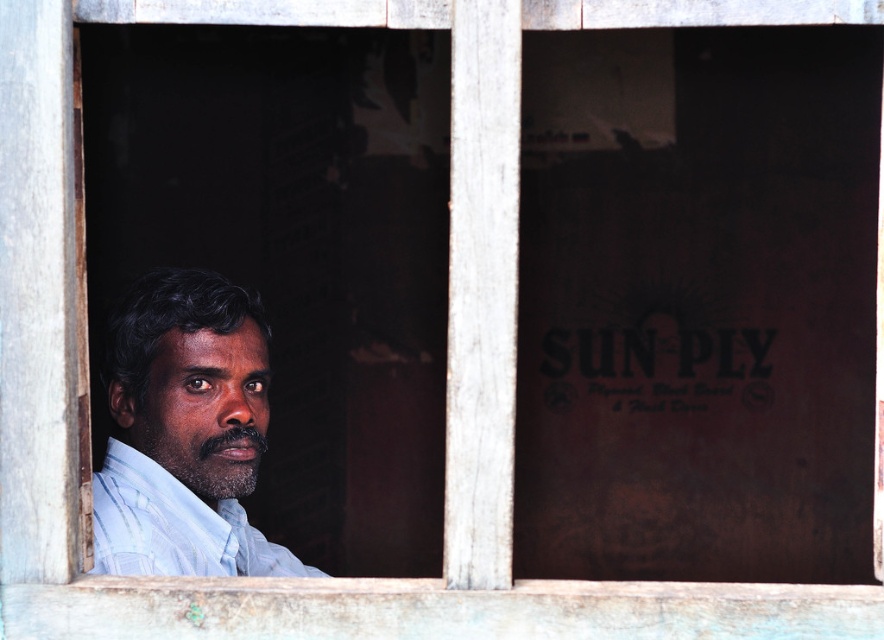
You are a photographer trying to capture both the light blue shirt at center and the light blue cotton shirt at left in a single shot. Which shirt should you focus on first to ensure both are in focus?

You should focus on the light blue cotton shirt at left first because it is farther away than the light blue shirt at center, ensuring both will be in focus.

Looking at this image, you are a tailor measuring shirts for a customer. You have two shirts to compare in the image. The first is the light blue shirt at center and the second is the light blue cotton shirt at left. Which shirt is closer to the edge of the frame?

The light blue shirt at center is closer to the edge of the frame because it is only 2.14 inches away from the light blue cotton shirt at left, which is further inward.